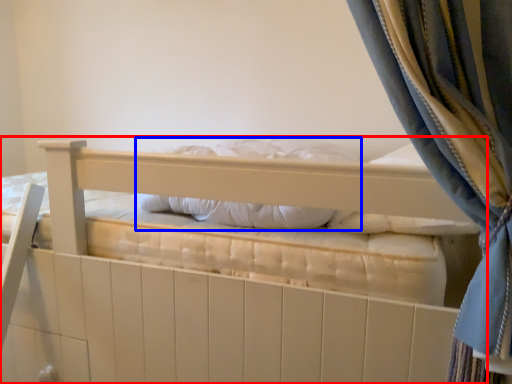
Question: Among these objects, which one is nearest to the camera, bed (highlighted by a red box) or pillow (highlighted by a blue box)?

Choices:
 (A) bed
 (B) pillow

Answer: (A)